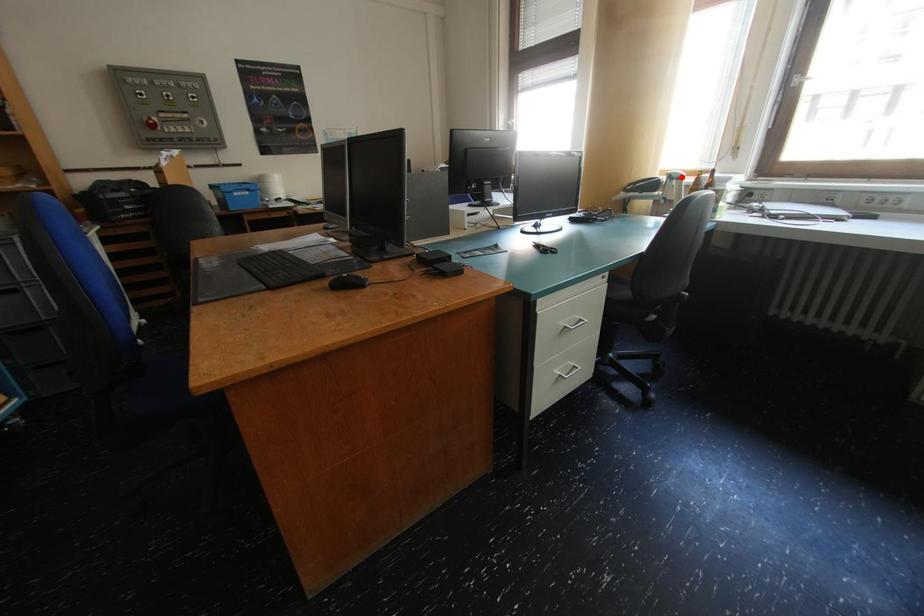
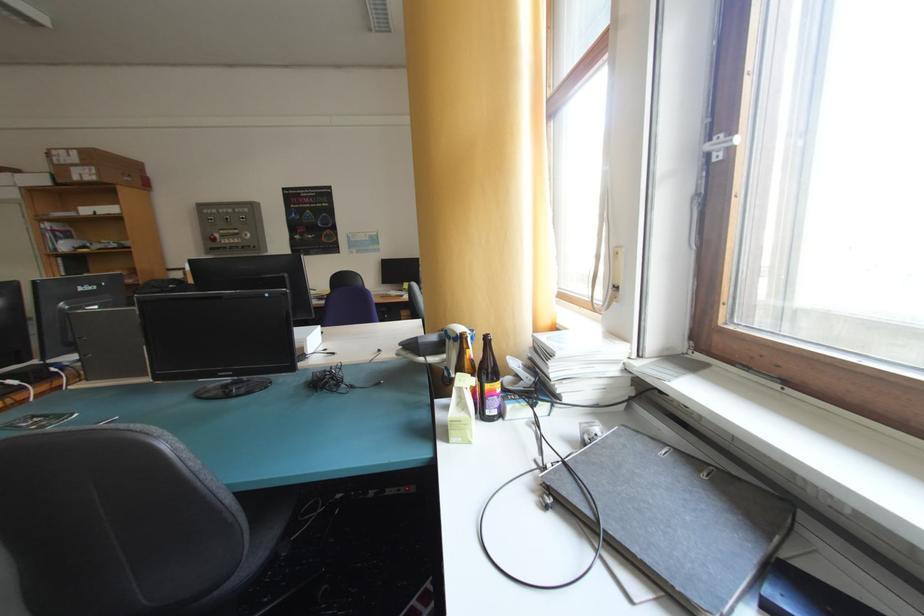
The point at the highlighted location is marked in the first image. Where is the corresponding point in the second image?

(457, 334)